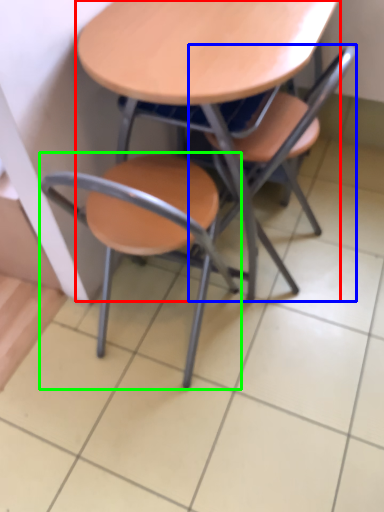
Question: Which object is positioned farthest from table (highlighted by a red box)? Select from chair (highlighted by a blue box) and chair (highlighted by a green box).

Choices:
 (A) chair
 (B) chair

Answer: (B)